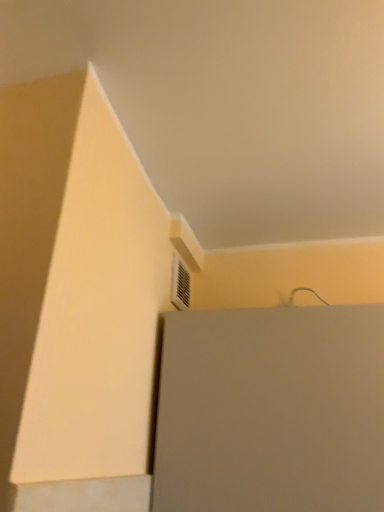
Question: In which direction should I rotate to look at white plastic air conditioning at upper center?

Choices:
 (A) right
 (B) left

Answer: (B)